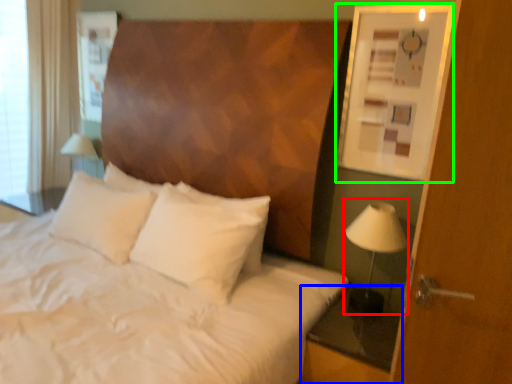
Question: Based on their relative distances, which object is farther from bedside lamp (highlighted by a red box)? Choose from nightstand (highlighted by a blue box) and picture frame (highlighted by a green box).

Choices:
 (A) nightstand
 (B) picture frame

Answer: (B)